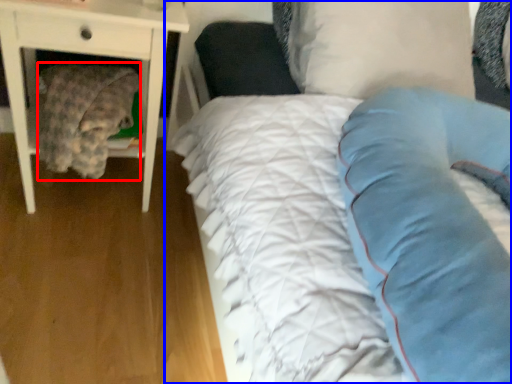
Question: Which object is further to the camera taking this photo, material (highlighted by a red box) or bed (highlighted by a blue box)?

Choices:
 (A) material
 (B) bed

Answer: (A)